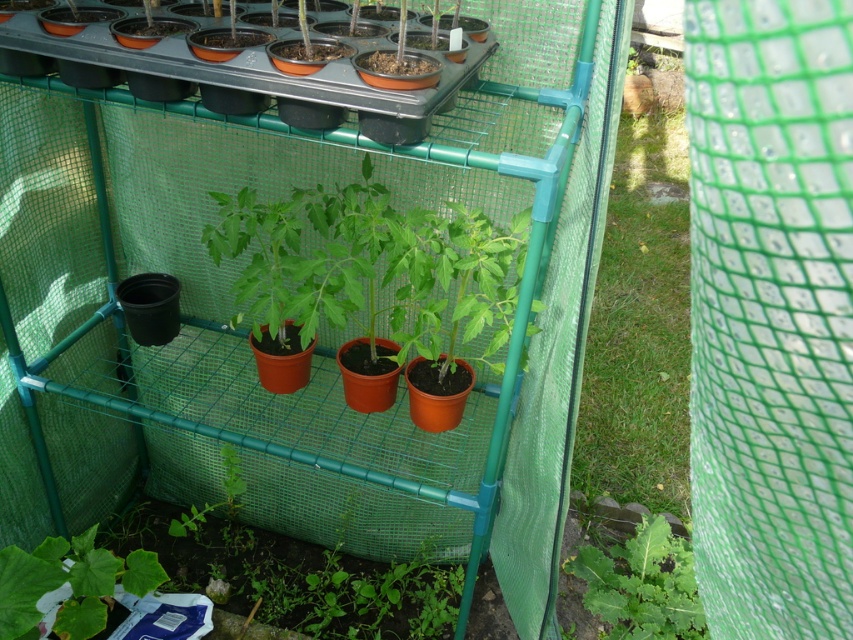
Can you confirm if green mesh at center is thinner than green matte leaf at lower left?

No.

Is point (624, 147) less distant than point (44, 564)?

No, (624, 147) is behind (44, 564).

The width and height of the screenshot is (853, 640). Describe the element at coordinates (639, 326) in the screenshot. I see `green mesh at center` at that location.

I want to click on green mesh at center, so click(639, 326).

What do you see at coordinates (642, 584) in the screenshot? I see `green leafy plant at lower right` at bounding box center [642, 584].

Is point (651, 604) closer to viewer compared to point (4, 586)?

No, (651, 604) is behind (4, 586).

The image size is (853, 640). What are the coordinates of `green leafy plant at lower right` in the screenshot? It's located at (642, 584).

Is green mesh at center closer to camera compared to green leafy plant at lower right?

No, green mesh at center is behind green leafy plant at lower right.

Who is more distant from viewer, (664,460) or (651,576)?

The point (664,460) is behind.

Does point (648, 256) lie behind point (659, 593)?

Yes.

Identify the location of green mesh at center. Image resolution: width=853 pixels, height=640 pixels. (639, 326).